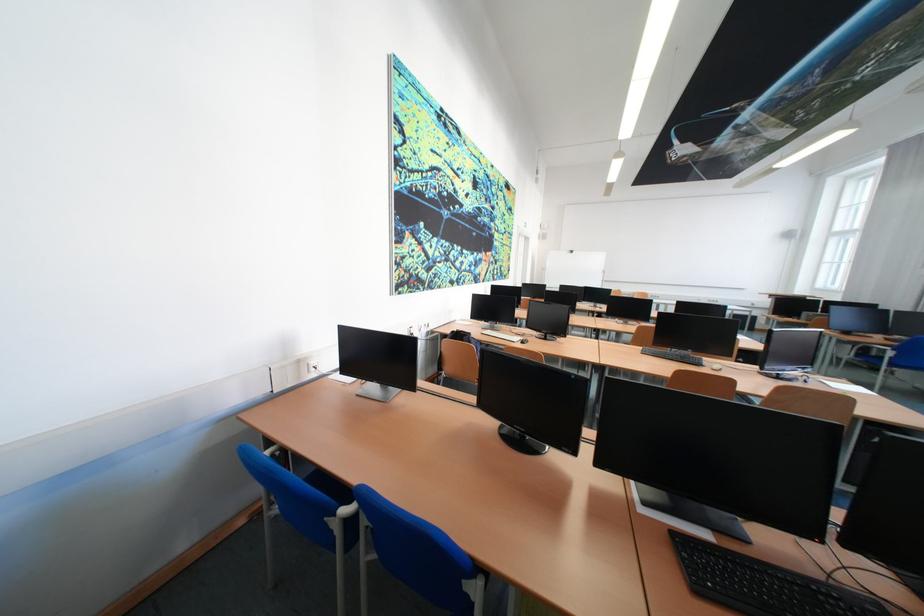
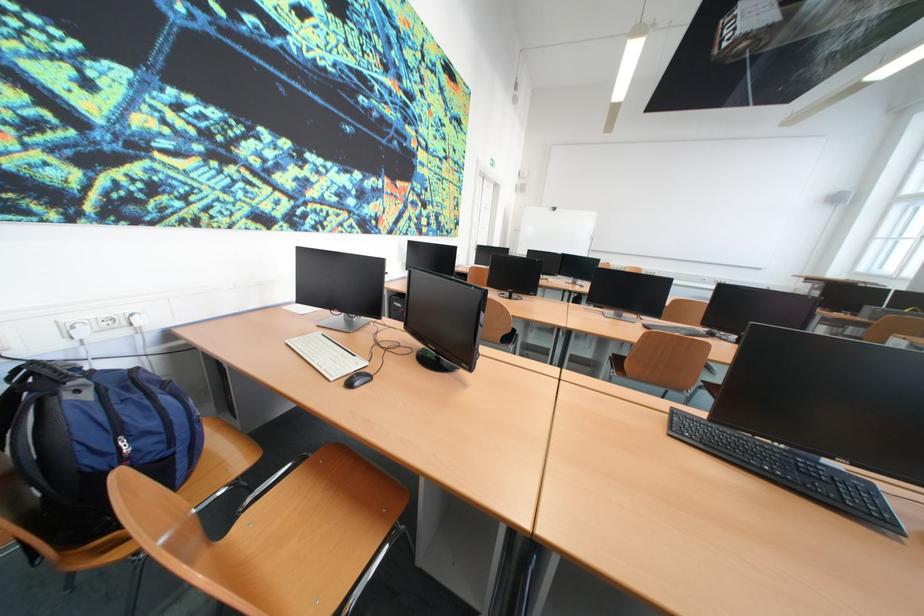
Based on the photo, in a continuous first-person perspective shot, in which direction is the camera moving?

The cameraman walked toward right, forward.